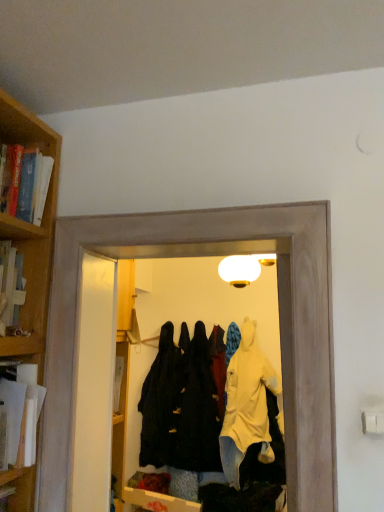
Question: Could white paper at left, acting as the first book starting from the bottom, be considered to be inside black matte coat at center, the third clothing viewed from the front?

Choices:
 (A) yes
 (B) no

Answer: (B)

Question: Can you confirm if black matte coat at center, which is the 1th clothing from back to front, is wider than white paper at left, acting as the first book starting from the bottom?

Choices:
 (A) yes
 (B) no

Answer: (A)

Question: From the image's perspective, would you say black matte coat at center, which is the 1th clothing from back to front, is positioned over white paper at left, acting as the first book starting from the bottom?

Choices:
 (A) yes
 (B) no

Answer: (B)

Question: Is there a large distance between black matte coat at center, the third clothing viewed from the front, and white paper at left, acting as the first book starting from the bottom?

Choices:
 (A) yes
 (B) no

Answer: (A)

Question: Is black matte coat at center, the third clothing viewed from the front, touching white paper at left, which appears as the 2th book when viewed from the top?

Choices:
 (A) yes
 (B) no

Answer: (B)

Question: Can you confirm if black matte coat at center, which is the 1th clothing from back to front, is positioned to the right of white paper at left, which appears as the 2th book when viewed from the top?

Choices:
 (A) yes
 (B) no

Answer: (A)

Question: From the image's perspective, is hardcover book at left, which is the 2th book from bottom to top, below yellow matte raincoat at center, which is counted as the second clothing, starting from the front?

Choices:
 (A) no
 (B) yes

Answer: (A)

Question: Is hardcover book at left, which is the 2th book from bottom to top, aimed at yellow matte raincoat at center, the 2th clothing from the back?

Choices:
 (A) no
 (B) yes

Answer: (A)

Question: Does hardcover book at left, which is the 2th book from bottom to top, appear on the right side of yellow matte raincoat at center, which is counted as the second clothing, starting from the front?

Choices:
 (A) yes
 (B) no

Answer: (B)

Question: From the image's perspective, is hardcover book at left, the 1th book in the top-to-bottom sequence, on top of yellow matte raincoat at center, which is counted as the second clothing, starting from the front?

Choices:
 (A) yes
 (B) no

Answer: (A)

Question: Does hardcover book at left, the 1th book in the top-to-bottom sequence, have a lesser height compared to yellow matte raincoat at center, which is counted as the second clothing, starting from the front?

Choices:
 (A) yes
 (B) no

Answer: (A)

Question: Is the depth of hardcover book at left, which is the 2th book from bottom to top, less than that of yellow matte raincoat at center, which is counted as the second clothing, starting from the front?

Choices:
 (A) yes
 (B) no

Answer: (A)

Question: From a real-world perspective, is white paper at left, which appears as the 2th book when viewed from the top, positioned under transparent plastic coat hanger at center based on gravity?

Choices:
 (A) no
 (B) yes

Answer: (B)